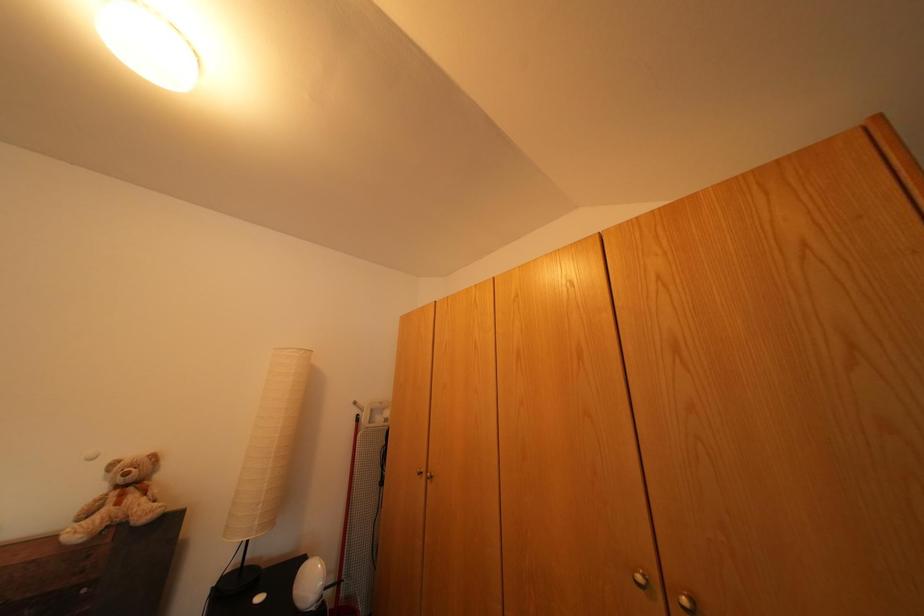
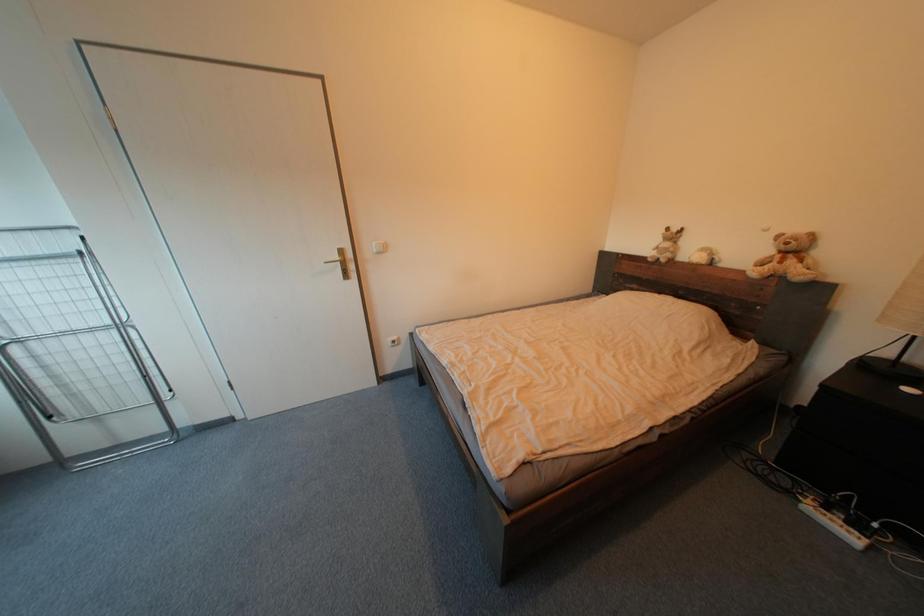
Question: The camera is either moving clockwise (left) or counter-clockwise (right) around the object. The first image is from the beginning of the video and the second image is from the end. Is the camera moving left or right when shooting the video?

Choices:
 (A) Left
 (B) Right

Answer: (B)